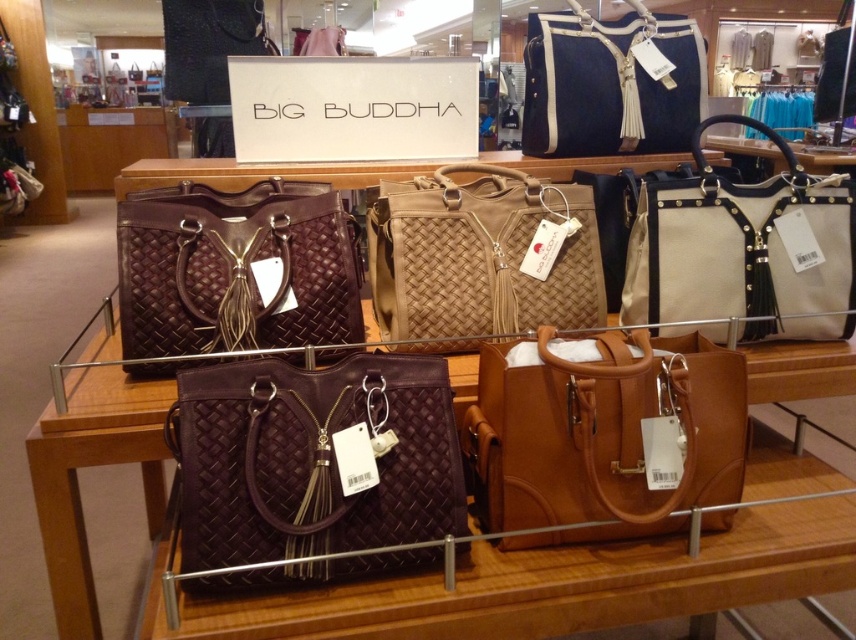
Can you confirm if beige canvas tote at right is thinner than dark blue woven tote at center?

No.

From the picture: Who is lower down, beige canvas tote at right or dark blue woven tote at center?

beige canvas tote at right

Describe the element at coordinates (742, 252) in the screenshot. I see `beige canvas tote at right` at that location.

You are a GUI agent. You are given a task and a screenshot of the screen. Output one action in this format:
    pyautogui.click(x=<x>, y=<y>)
    Task: Click on the beige canvas tote at right
    
    Given the screenshot: What is the action you would take?
    pyautogui.click(x=742, y=252)

Who is higher up, matte brown leather handbag at center or tan woven tote at center?

tan woven tote at center is higher up.

Who is more distant from viewer, (621, 522) or (510, 212)?

The point (510, 212) is more distant.

Does point (513, 426) come closer to viewer compared to point (553, 211)?

Yes, it is.

Find the location of a particular element. This screenshot has width=856, height=640. matte brown leather handbag at center is located at coordinates point(604,435).

Can you confirm if beige canvas tote at right is positioned to the left of tan woven tote at center?

No, beige canvas tote at right is not to the left of tan woven tote at center.

Is beige canvas tote at right further to camera compared to tan woven tote at center?

That is False.

Does point (669, 262) come in front of point (501, 180)?

Yes.

Identify the location of beige canvas tote at right. tap(742, 252).